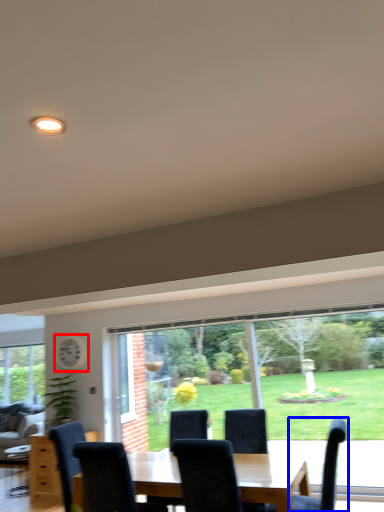
Question: Among these objects, which one is farthest to the camera, clock (highlighted by a red box) or chair (highlighted by a blue box)?

Choices:
 (A) clock
 (B) chair

Answer: (A)